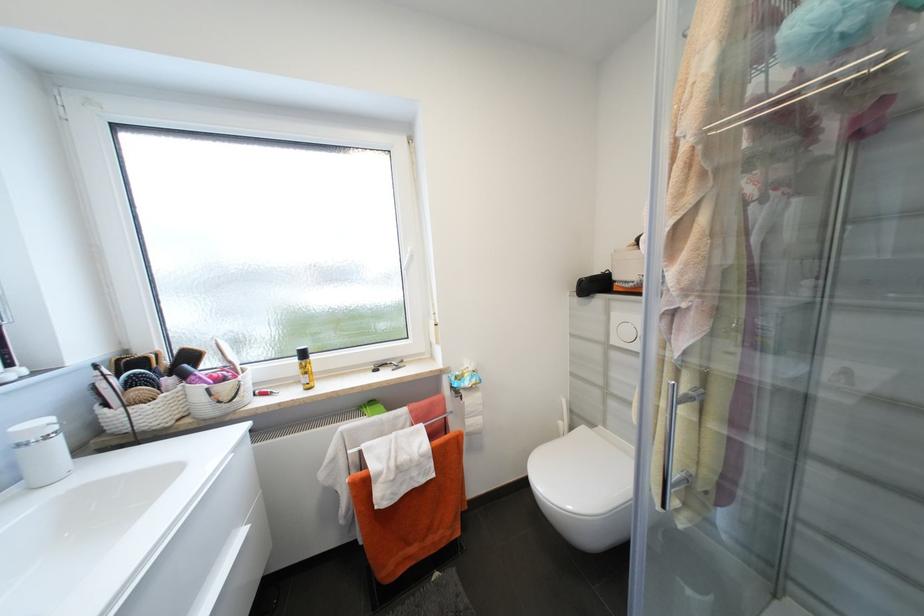
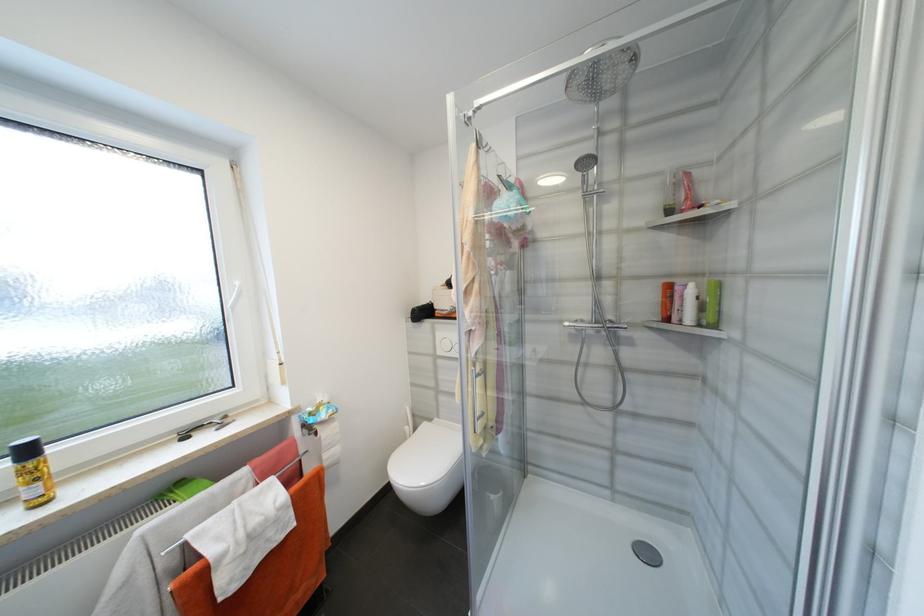
In the second image, find the point that corresponds to (x=621, y=342) in the first image.

(445, 353)